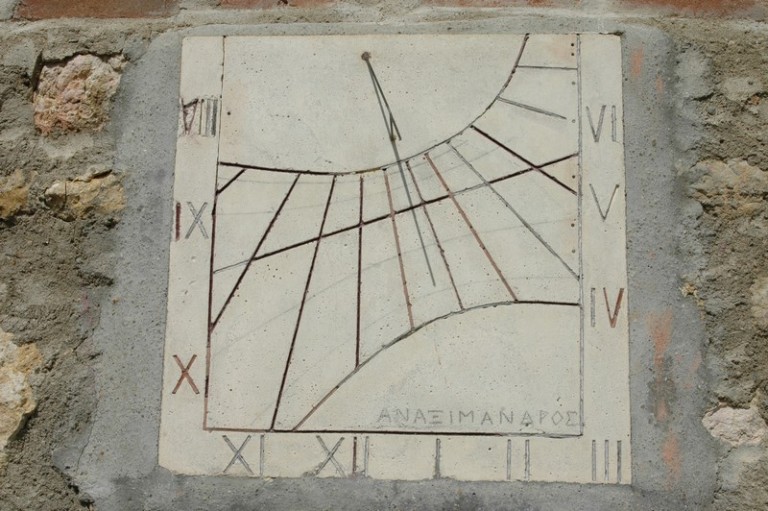
Identify the location of floor on the left side. The height and width of the screenshot is (511, 768). (28, 293).